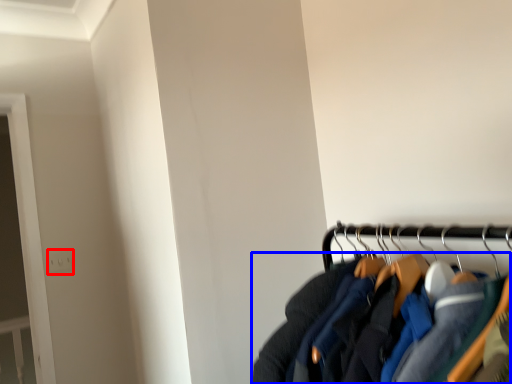
Question: Which of the following is the farthest to the observer, electric outlet (highlighted by a red box) or jacket (highlighted by a blue box)?

Choices:
 (A) electric outlet
 (B) jacket

Answer: (A)